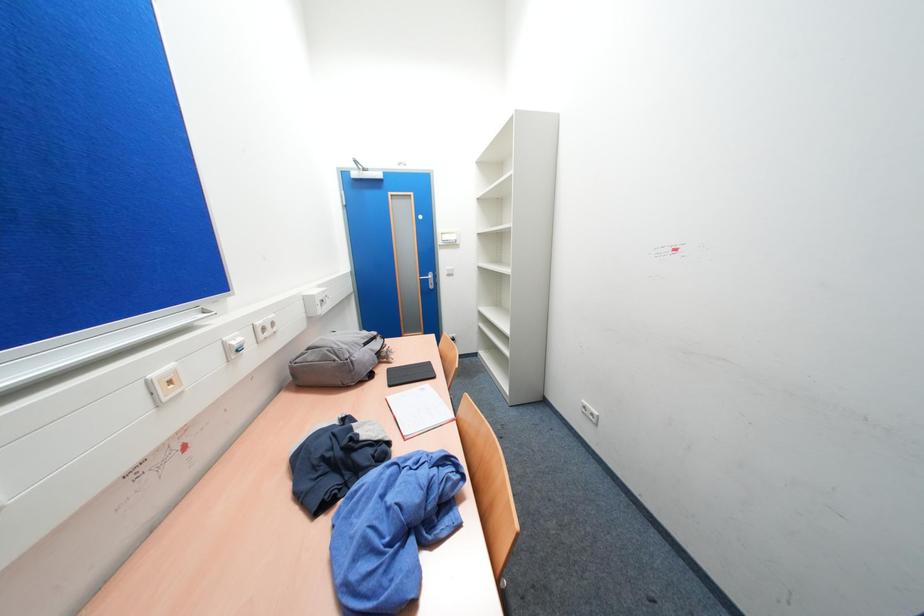
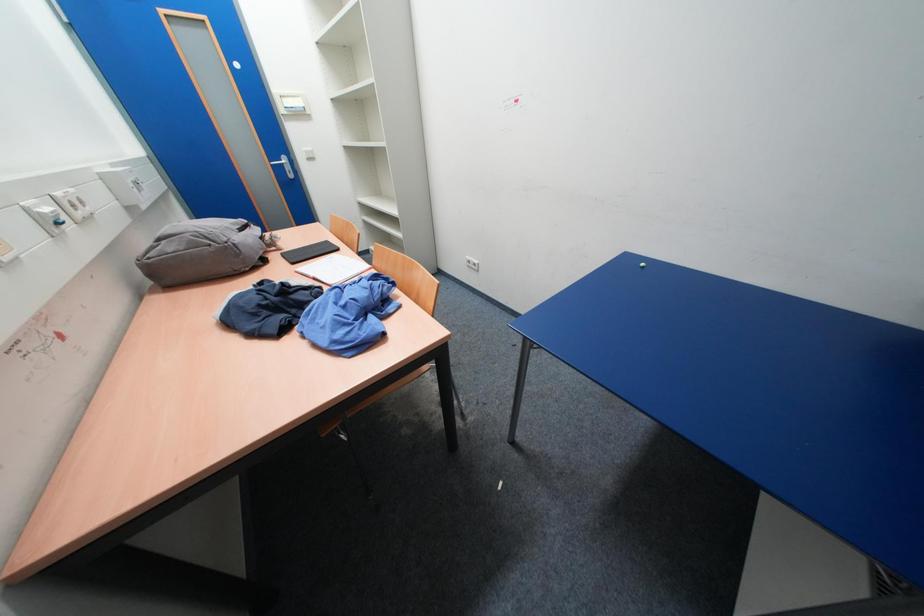
The first image is from the beginning of the video and the second image is from the end. How did the camera likely rotate when shooting the video?

The camera rotated toward right-down.